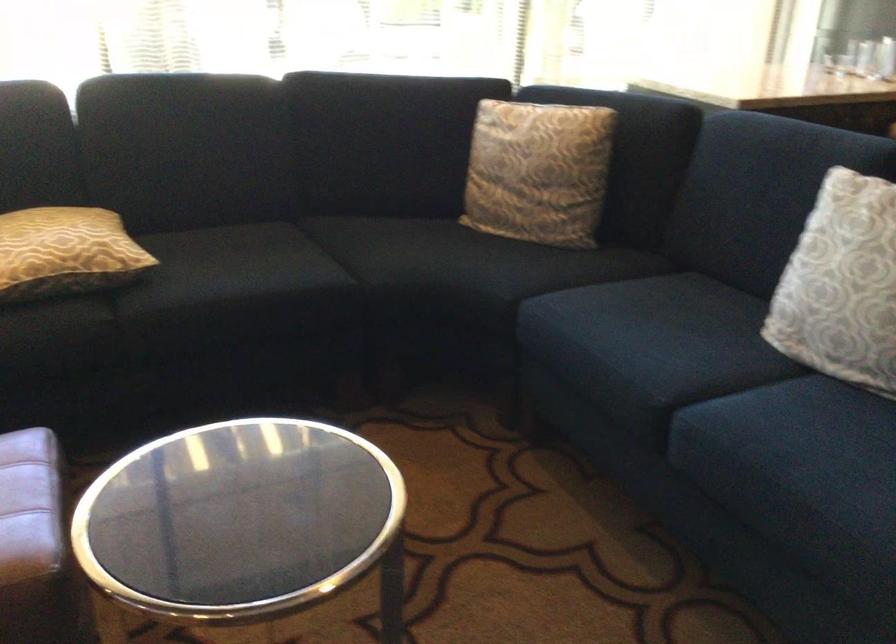
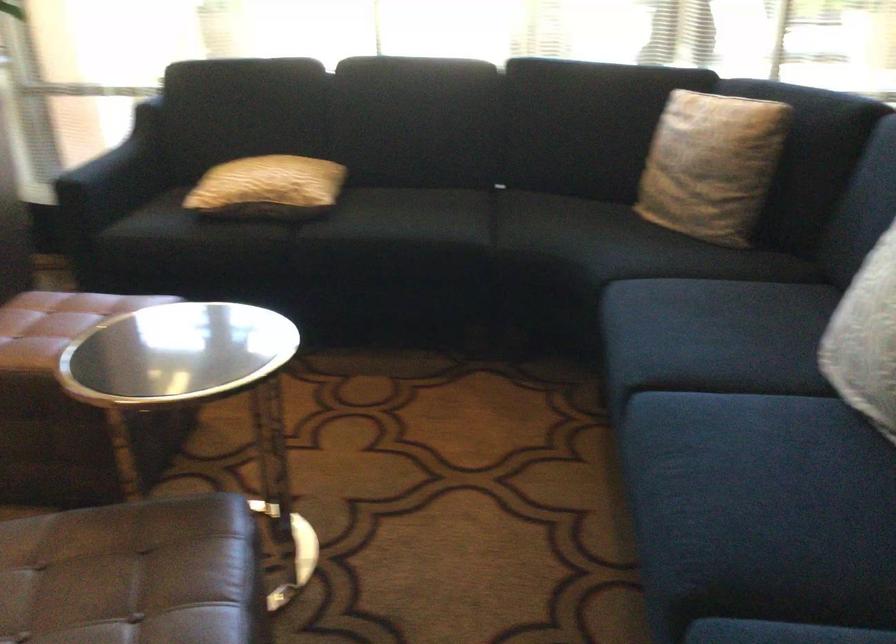
Locate, in the second image, the point that corresponds to (x=553, y=175) in the first image.

(711, 165)